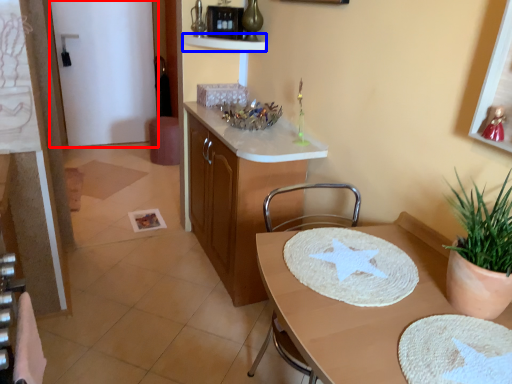
Question: Which of the following is the farthest to the observer, glass door (highlighted by a red box) or shelf (highlighted by a blue box)?

Choices:
 (A) glass door
 (B) shelf

Answer: (A)